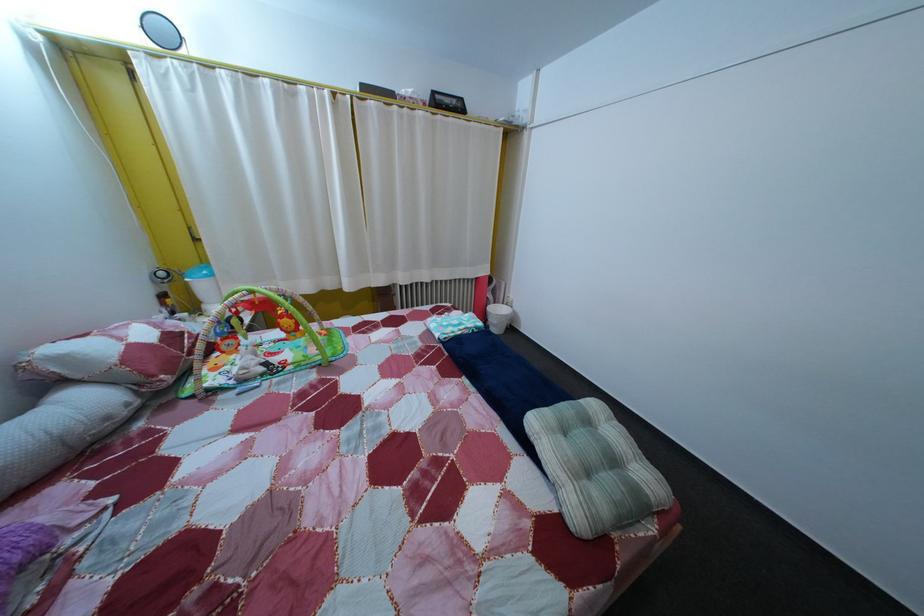
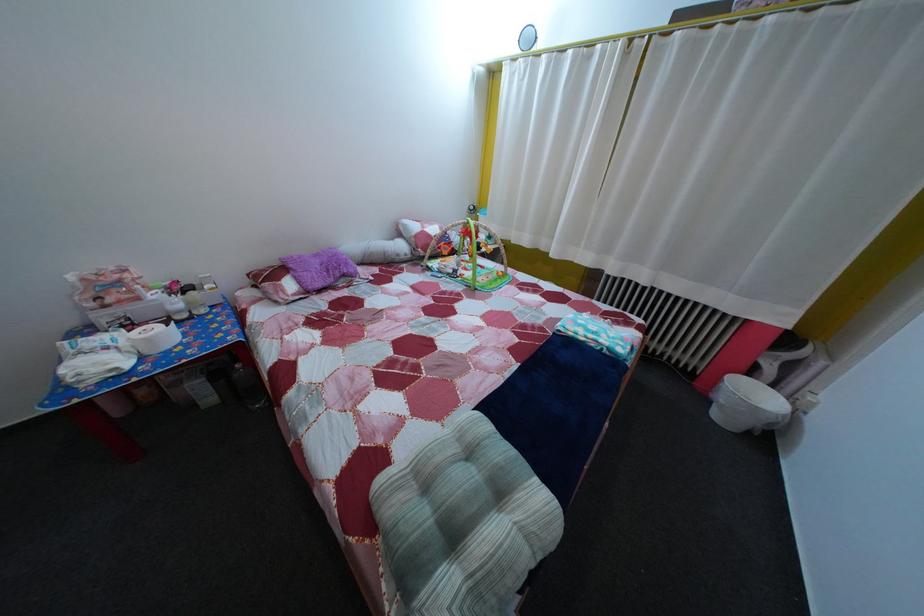
Where in the second image is the point corresponding to the point at 273,377 from the first image?

(459, 278)